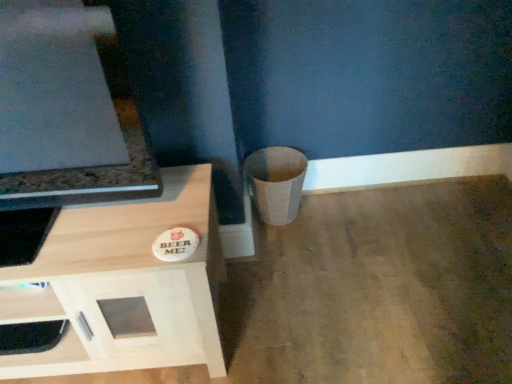
This screenshot has width=512, height=384. Describe the element at coordinates (124, 285) in the screenshot. I see `light wood cabinet at lower left` at that location.

This screenshot has width=512, height=384. Describe the element at coordinates (29, 305) in the screenshot. I see `white matte drawer at lower left` at that location.

Find the location of a particular element. The width and height of the screenshot is (512, 384). light wood cabinet at lower left is located at coordinates (124, 285).

Are light wood cabinet at lower left and matte beige trash can at lower right beside each other?

There is a gap between light wood cabinet at lower left and matte beige trash can at lower right.

From a real-world perspective, is light wood cabinet at lower left located beneath matte beige trash can at lower right?

No, from a real-world perspective, light wood cabinet at lower left is not below matte beige trash can at lower right.

Who is shorter, light wood cabinet at lower left or matte beige trash can at lower right?

Standing shorter between the two is matte beige trash can at lower right.

Considering the relative positions of matte beige trash can at lower right and light wood cabinet at lower left in the image provided, is matte beige trash can at lower right to the right of light wood cabinet at lower left from the viewer's perspective?

Correct, you'll find matte beige trash can at lower right to the right of light wood cabinet at lower left.

Based on the photo, are matte beige trash can at lower right and light wood cabinet at lower left beside each other?

No, matte beige trash can at lower right is not in contact with light wood cabinet at lower left.

From a real-world perspective, is matte beige trash can at lower right under light wood cabinet at lower left?

Yes, from a real-world perspective, matte beige trash can at lower right is under light wood cabinet at lower left.

Image resolution: width=512 pixels, height=384 pixels. In order to click on cabinetry below the matte beige trash can at lower right (from the image's perspective) in this screenshot , I will do `click(124, 285)`.

Consider the image. Is light wood cabinet at lower left placed right next to white matte drawer at lower left?

light wood cabinet at lower left is not next to white matte drawer at lower left, and they're not touching.

Who is shorter, light wood cabinet at lower left or white matte drawer at lower left?

With less height is white matte drawer at lower left.

From the image's perspective, is light wood cabinet at lower left positioned above or below white matte drawer at lower left?

From the image's perspective, light wood cabinet at lower left appears above white matte drawer at lower left.

Is the position of light wood cabinet at lower left more distant than that of white matte drawer at lower left?

No, light wood cabinet at lower left is closer to the camera.

Can you tell me how much matte beige trash can at lower right and white matte drawer at lower left differ in facing direction?

The facing directions of matte beige trash can at lower right and white matte drawer at lower left are 0.00344 degrees apart.

Is point (274, 209) closer or farther from the camera than point (45, 304)?

Point (274, 209) appears to be farther away from the viewer than point (45, 304).

Considering the relative sizes of matte beige trash can at lower right and white matte drawer at lower left in the image provided, is matte beige trash can at lower right taller than white matte drawer at lower left?

Correct, matte beige trash can at lower right is much taller as white matte drawer at lower left.

Consider the image. Are matte beige trash can at lower right and white matte drawer at lower left beside each other?

They are not placed beside each other.

Locate an element on the screen. drawer that is above the matte beige trash can at lower right (from a real-world perspective) is located at coordinates (29, 305).

Consider the image. Considering the relative positions of white matte drawer at lower left and matte beige trash can at lower right in the image provided, is white matte drawer at lower left to the left of matte beige trash can at lower right from the viewer's perspective?

Correct, you'll find white matte drawer at lower left to the left of matte beige trash can at lower right.

Considering the sizes of objects white matte drawer at lower left and matte beige trash can at lower right in the image provided, who is thinner, white matte drawer at lower left or matte beige trash can at lower right?

white matte drawer at lower left is thinner.

Considering the relative sizes of white matte drawer at lower left and matte beige trash can at lower right in the image provided, is white matte drawer at lower left smaller than matte beige trash can at lower right?

Correct, white matte drawer at lower left occupies less space than matte beige trash can at lower right.

Does white matte drawer at lower left have a greater width compared to light wood cabinet at lower left?

Incorrect, the width of white matte drawer at lower left does not surpass that of light wood cabinet at lower left.

Is white matte drawer at lower left located outside light wood cabinet at lower left?

That's incorrect, white matte drawer at lower left is not completely outside light wood cabinet at lower left.

Can you confirm if white matte drawer at lower left is bigger than light wood cabinet at lower left?

No, white matte drawer at lower left is not bigger than light wood cabinet at lower left.

You are a GUI agent. You are given a task and a screenshot of the screen. Output one action in this format:
    pyautogui.click(x=<x>, y=<y>)
    Task: Click on the trash bin/can lying above the light wood cabinet at lower left (from the image's perspective)
    The width and height of the screenshot is (512, 384).
    Given the screenshot: What is the action you would take?
    pyautogui.click(x=276, y=182)

What are the coordinates of `cabinetry above the matte beige trash can at lower right (from a real-world perspective)` in the screenshot? It's located at (124, 285).

When comparing their distances from white matte drawer at lower left, does light wood cabinet at lower left or matte beige trash can at lower right seem closer?

The object closer to white matte drawer at lower left is light wood cabinet at lower left.

Looking at the image, which one is located closer to light wood cabinet at lower left, matte beige trash can at lower right or white matte drawer at lower left?

Based on the image, white matte drawer at lower left appears to be nearer to light wood cabinet at lower left.

When comparing their distances from light wood cabinet at lower left, does white matte drawer at lower left or matte beige trash can at lower right seem further?

Among the two, matte beige trash can at lower right is located further to light wood cabinet at lower left.

From the image, which object appears to be nearer to matte beige trash can at lower right, white matte drawer at lower left or light wood cabinet at lower left?

Among the two, light wood cabinet at lower left is located nearer to matte beige trash can at lower right.

When comparing their distances from white matte drawer at lower left, does matte beige trash can at lower right or light wood cabinet at lower left seem further?

matte beige trash can at lower right is further to white matte drawer at lower left.

Considering their positions, is light wood cabinet at lower left positioned further to matte beige trash can at lower right than white matte drawer at lower left?

white matte drawer at lower left is further to matte beige trash can at lower right.

Where is `cabinetry situated between white matte drawer at lower left and matte beige trash can at lower right from left to right`? This screenshot has height=384, width=512. cabinetry situated between white matte drawer at lower left and matte beige trash can at lower right from left to right is located at coordinates (124, 285).